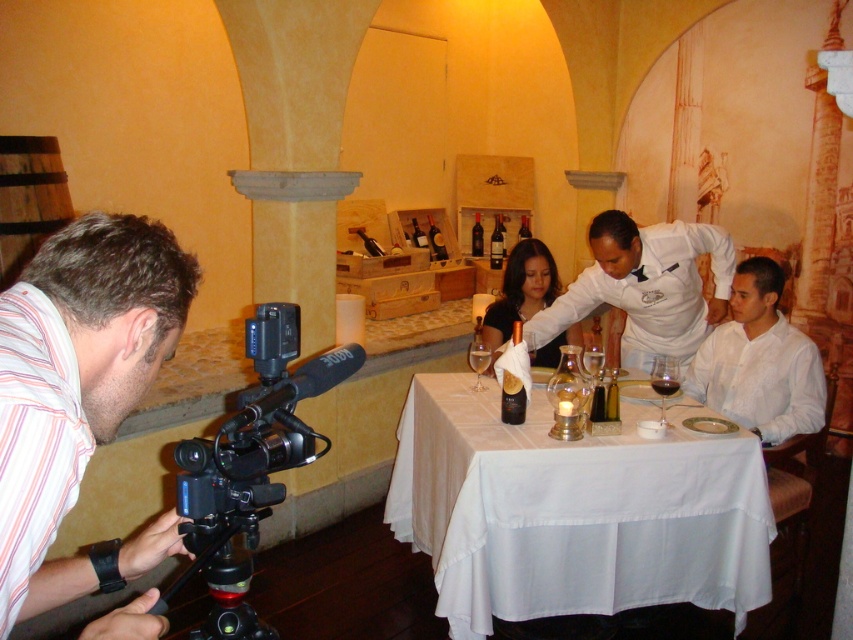
Question: Can you confirm if matte black dress at center is wider than translucent glass wine glass at table right?

Choices:
 (A) no
 (B) yes

Answer: (B)

Question: Among these objects, which one is farthest from the camera?

Choices:
 (A) red glass wine at table center
 (B) white smooth shirt at right
 (C) black plastic video camera at lower left

Answer: (B)

Question: Can you confirm if black plastic video camera at lower left is positioned to the left of translucent glass wine at table center?

Choices:
 (A) yes
 (B) no

Answer: (A)

Question: Among these objects, which one is nearest to the camera?

Choices:
 (A) white smooth shirt at right
 (B) striped cotton shirt at lower left
 (C) white uniform at center
 (D) matte black dress at center

Answer: (B)

Question: Considering the real-world distances, which object is closest to the black plastic video camera at lower left?

Choices:
 (A) clear glass wine glass at table center
 (B) striped cotton shirt at lower left

Answer: (B)

Question: Observing the image, what is the correct spatial positioning of white uniform at center in reference to translucent glass wine glass at table right?

Choices:
 (A) above
 (B) below

Answer: (A)